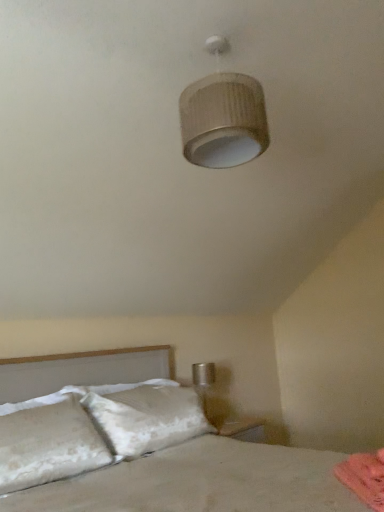
Question: Considering the relative sizes of matte beige lampshade at upper center and pink fabric at lower right in the image provided, is matte beige lampshade at upper center thinner than pink fabric at lower right?

Choices:
 (A) no
 (B) yes

Answer: (A)

Question: Are matte beige lampshade at upper center and pink fabric at lower right far apart?

Choices:
 (A) yes
 (B) no

Answer: (A)

Question: Is pink fabric at lower right inside matte beige lampshade at upper center?

Choices:
 (A) yes
 (B) no

Answer: (B)

Question: Is matte beige lampshade at upper center positioned with its back to pink fabric at lower right?

Choices:
 (A) no
 (B) yes

Answer: (A)

Question: Is matte beige lampshade at upper center to the right of pink fabric at lower right from the viewer's perspective?

Choices:
 (A) yes
 (B) no

Answer: (B)

Question: Does matte beige lampshade at upper center have a greater height compared to pink fabric at lower right?

Choices:
 (A) yes
 (B) no

Answer: (A)

Question: From a real-world perspective, is white textured bed at lower left physically below pink fabric at lower right?

Choices:
 (A) yes
 (B) no

Answer: (B)

Question: Does white textured bed at lower left contain pink fabric at lower right?

Choices:
 (A) no
 (B) yes

Answer: (B)

Question: Is white textured bed at lower left bigger than pink fabric at lower right?

Choices:
 (A) no
 (B) yes

Answer: (B)

Question: Is white textured bed at lower left further to camera compared to pink fabric at lower right?

Choices:
 (A) no
 (B) yes

Answer: (A)

Question: Does white textured bed at lower left appear on the left side of pink fabric at lower right?

Choices:
 (A) no
 (B) yes

Answer: (B)

Question: Is white textured bed at lower left aimed at pink fabric at lower right?

Choices:
 (A) yes
 (B) no

Answer: (A)

Question: Is white textured bed at lower left positioned before matte beige lampshade at upper center?

Choices:
 (A) yes
 (B) no

Answer: (A)